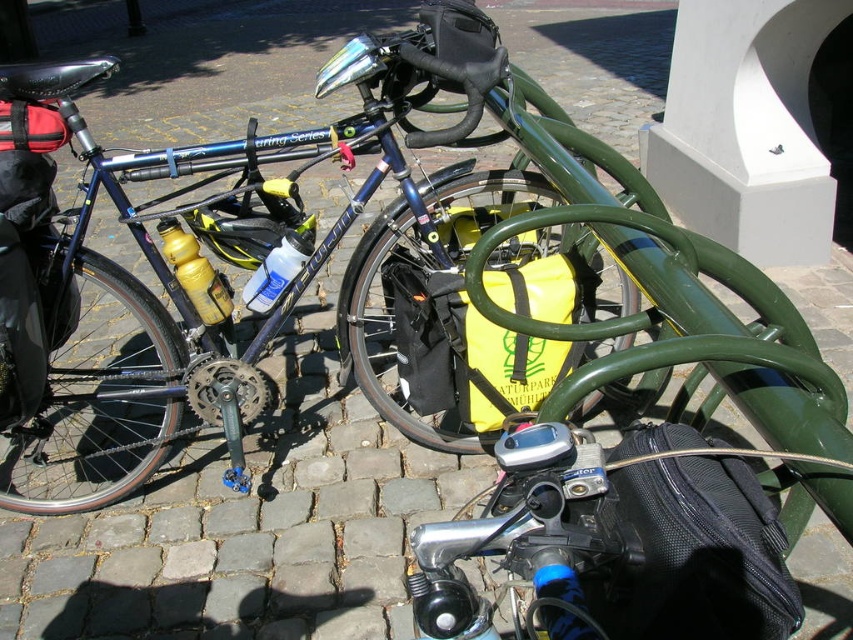
Question: Can you confirm if black mesh bag at lower right is positioned to the left of yellow matte bag at center?

Choices:
 (A) no
 (B) yes

Answer: (A)

Question: Which point is closer to the camera taking this photo?

Choices:
 (A) (706, 484)
 (B) (413, 368)

Answer: (A)

Question: Can you confirm if black mesh bag at lower right is positioned to the right of yellow matte bag at center?

Choices:
 (A) no
 (B) yes

Answer: (B)

Question: Which point is closer to the camera?

Choices:
 (A) black mesh bag at lower right
 (B) yellow matte bag at center

Answer: (A)

Question: Can you confirm if black mesh bag at lower right is thinner than yellow matte bag at center?

Choices:
 (A) no
 (B) yes

Answer: (B)